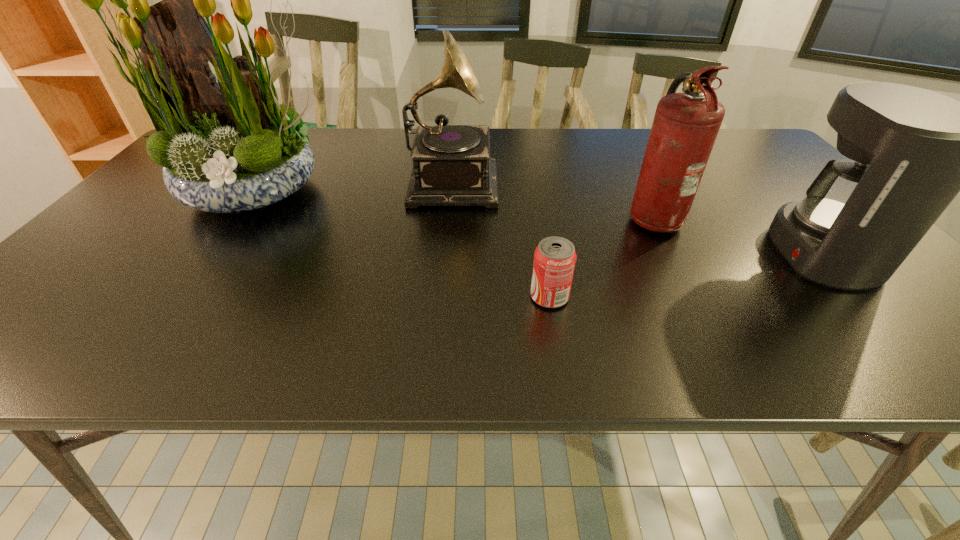
The width and height of the screenshot is (960, 540). I want to click on the leftmost object, so click(229, 146).

You are a GUI agent. You are given a task and a screenshot of the screen. Output one action in this format:
    pyautogui.click(x=<x>, y=<y>)
    Task: Click on the tallest object
    The image size is (960, 540).
    Given the screenshot: What is the action you would take?
    pyautogui.click(x=229, y=146)

Image resolution: width=960 pixels, height=540 pixels. What are the coordinates of `the second object from left to right` in the screenshot? It's located at (452, 166).

The image size is (960, 540). Identify the location of fire extinguisher. (685, 126).

Where is `the rightmost object`? This screenshot has width=960, height=540. the rightmost object is located at coordinates (911, 151).

The width and height of the screenshot is (960, 540). Identify the location of soda can. (555, 257).

The width and height of the screenshot is (960, 540). In order to click on the shortest object in this screenshot , I will do click(555, 257).

Find the location of `free space located on the front-facing side of the flower arrangement`. free space located on the front-facing side of the flower arrangement is located at coordinates (209, 255).

What are the coordinates of `vacant space situated on the horn of the fourth object from right to left` in the screenshot? It's located at (610, 180).

The image size is (960, 540). I want to click on vacant space located at the front of the fire extinguisher where the nozzle is aimed, so click(587, 217).